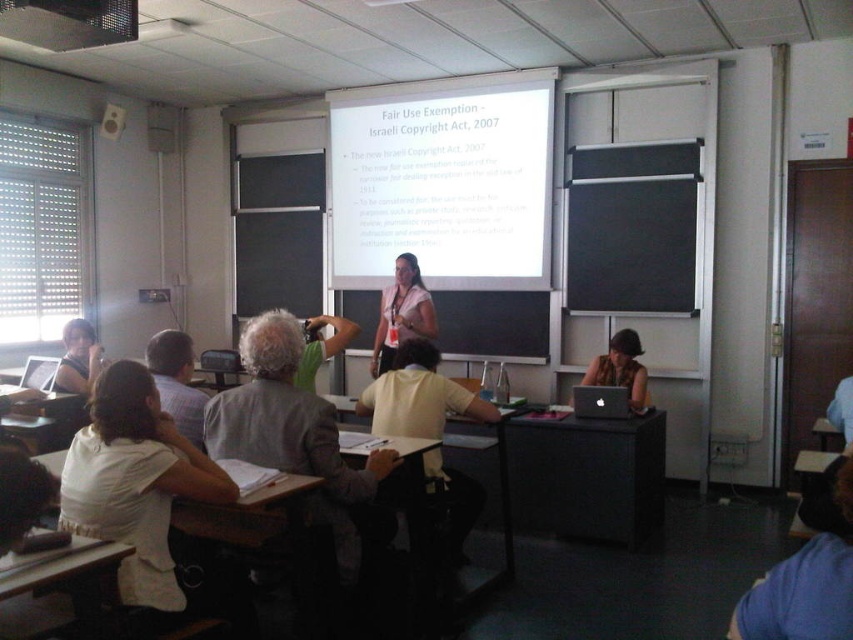
Is matte black laptop at lower right positioned before matte black shirt at left?

Yes.

Is matte black laptop at lower right behind matte black shirt at left?

No.

Between point (635, 404) and point (91, 326), which one is positioned behind?

The point (91, 326) is behind.

Identify the location of matte black laptop at lower right. The image size is (853, 640). (621, 369).

Does white matte projection screen at upper center have a larger size compared to white cotton shirt at lower left?

Correct, white matte projection screen at upper center is larger in size than white cotton shirt at lower left.

Is white matte projection screen at upper center wider than white cotton shirt at lower left?

Yes.

Image resolution: width=853 pixels, height=640 pixels. Describe the element at coordinates (442, 180) in the screenshot. I see `white matte projection screen at upper center` at that location.

Where is `white matte projection screen at upper center`? white matte projection screen at upper center is located at coordinates (442, 180).

The image size is (853, 640). What do you see at coordinates (442, 180) in the screenshot?
I see `white matte projection screen at upper center` at bounding box center [442, 180].

Is point (457, 129) closer to viewer compared to point (404, 282)?

That is False.

At what (x,y) coordinates should I click in order to perform the action: click on white matte projection screen at upper center. Please return your answer as a coordinate pair (x, y). Looking at the image, I should click on (442, 180).